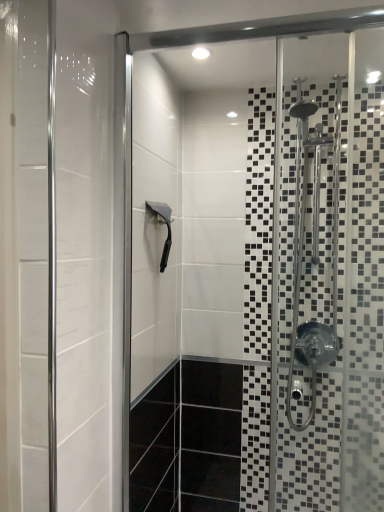
Where is `transparent glass shower door at center`? transparent glass shower door at center is located at coordinates (275, 128).

This screenshot has height=512, width=384. What do you see at coordinates (275, 128) in the screenshot?
I see `transparent glass shower door at center` at bounding box center [275, 128].

Image resolution: width=384 pixels, height=512 pixels. I want to click on transparent glass shower door at center, so click(x=275, y=128).